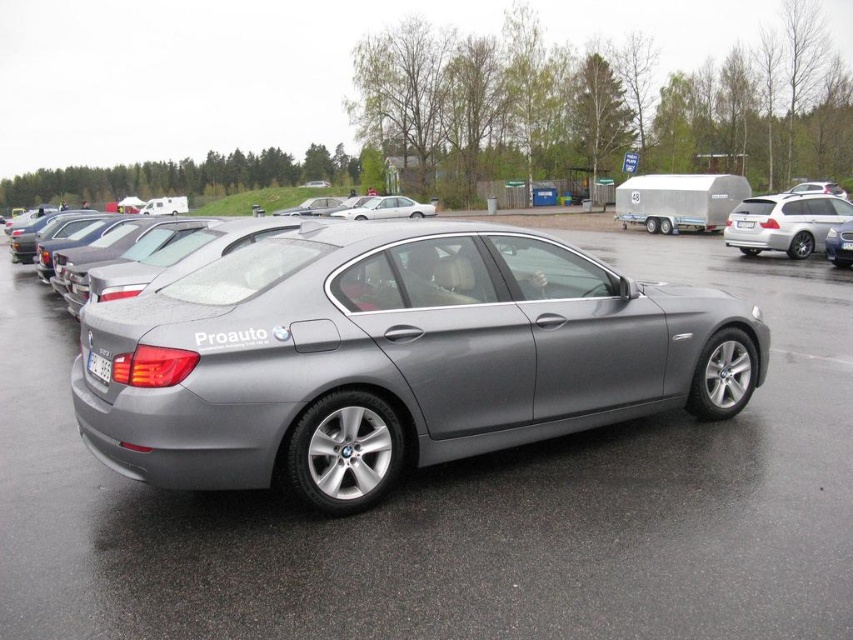
You are a delivery person who needs to confirm the license plate numbers of two vehicles in the parking lot. You see a white plastic license plate at rear and a white plastic license plate at center. Which license plate is positioned lower in the image?

The white plastic license plate at rear is located below the white plastic license plate at center, so the one at the rear is positioned lower.

You are a delivery person with a cart that is 3 meters wide. You need to move from the satin metallic car at center to the white glossy sedan at center. Is there enough space between them to pass through with your cart?

The distance between the satin metallic car at center and the white glossy sedan at center is 28.30 meters, which is more than enough space for a 3 meter wide cart to pass through.